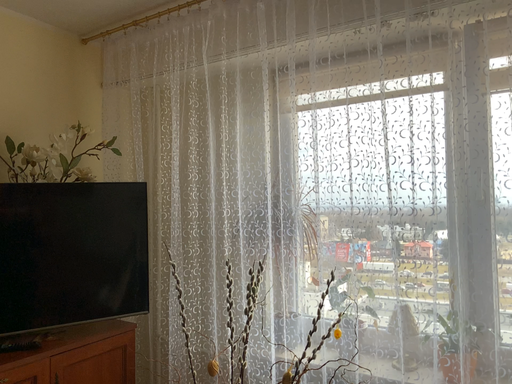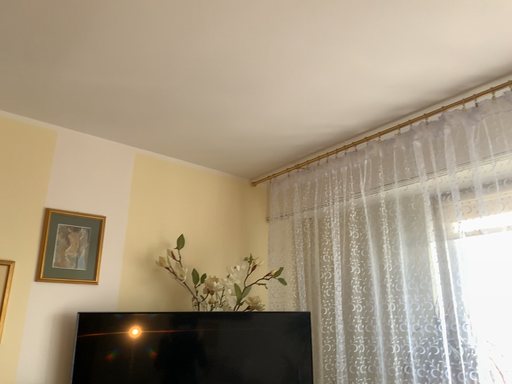
Question: How did the camera likely rotate when shooting the video?

Choices:
 (A) rotated left
 (B) rotated right

Answer: (A)